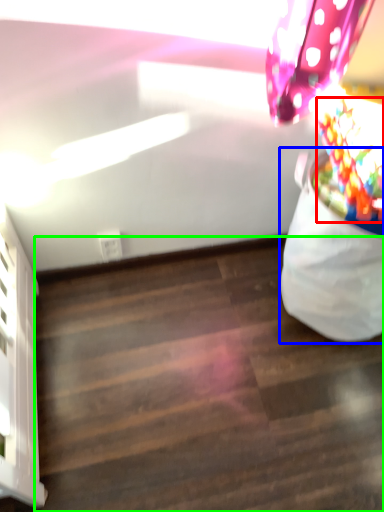
Question: Considering the real-world distances, which object is farthest from flower (highlighted by a red box)? bean bag chair (highlighted by a blue box) or stairwell (highlighted by a green box)?

Choices:
 (A) bean bag chair
 (B) stairwell

Answer: (B)